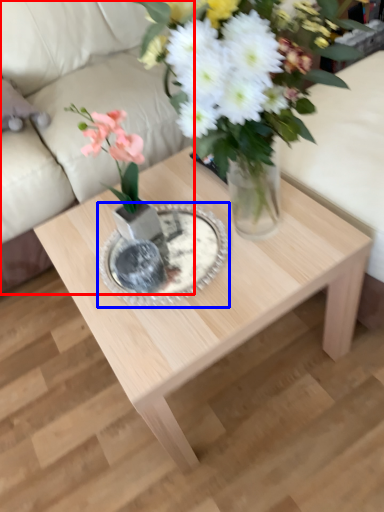
Question: Which point is closer to the camera, couch (highlighted by a red box) or glass plate (highlighted by a blue box)?

Choices:
 (A) couch
 (B) glass plate

Answer: (B)